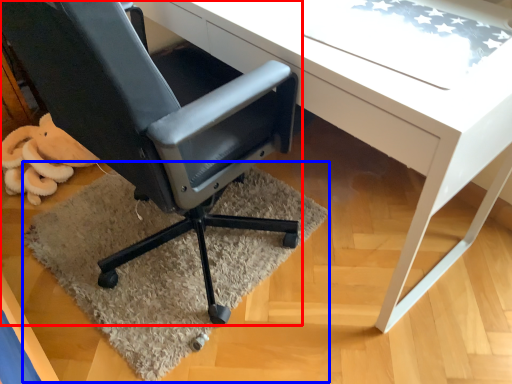
Question: Which object appears closest to the camera in this image, chair (highlighted by a red box) or mat (highlighted by a blue box)?

Choices:
 (A) chair
 (B) mat

Answer: (A)